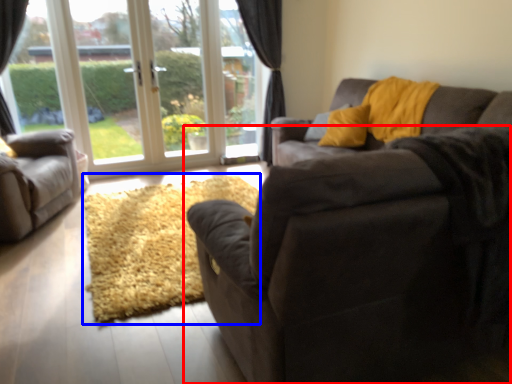
Question: Among these objects, which one is farthest to the camera, studio couch (highlighted by a red box) or doormat (highlighted by a blue box)?

Choices:
 (A) studio couch
 (B) doormat

Answer: (B)